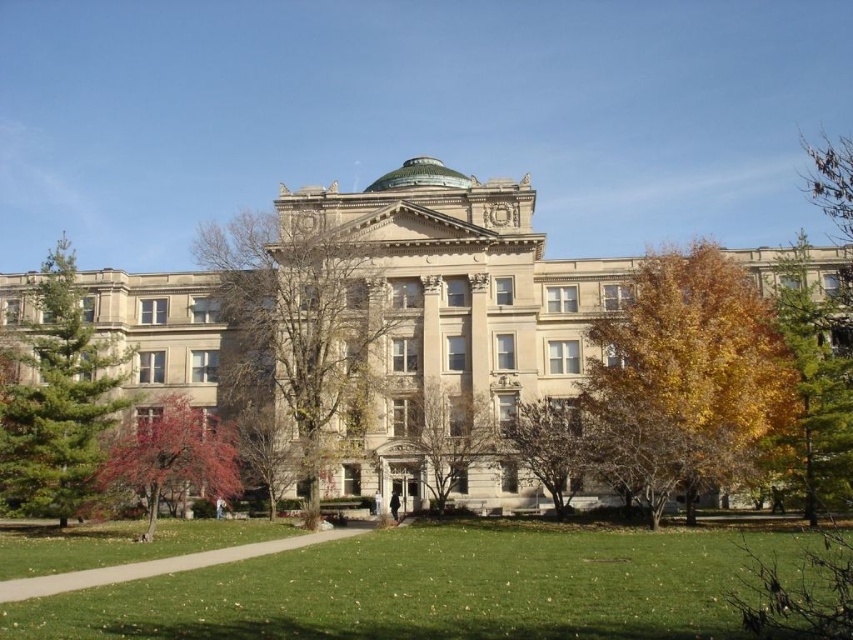
Question: Can you confirm if green leafy tree at right is positioned to the left of reddish-brown bark tree at lower left?

Choices:
 (A) yes
 (B) no

Answer: (B)

Question: Is yellow leafy tree at right bigger than green coniferous tree at left?

Choices:
 (A) no
 (B) yes

Answer: (A)

Question: Does reddish-brown bark tree at lower left have a lesser width compared to green leafy tree at center?

Choices:
 (A) yes
 (B) no

Answer: (B)

Question: Which point appears closest to the camera in this image?

Choices:
 (A) (119, 445)
 (B) (759, 326)
 (C) (780, 305)

Answer: (B)

Question: Among these points, which one is nearest to the camera?

Choices:
 (A) 244,442
 (B) 674,262
 (C) 819,493
 (D) 445,445

Answer: (C)

Question: Which point is farther from the camera taking this photo?

Choices:
 (A) (49, 344)
 (B) (115, 454)

Answer: (A)